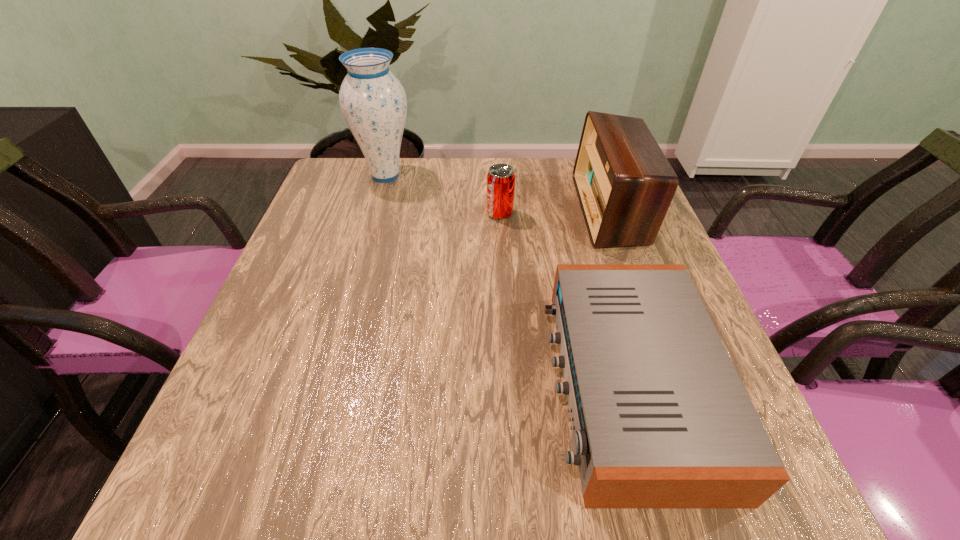
Find the location of a particular element. The image size is (960, 540). the leftmost object is located at coordinates (373, 102).

Find the location of `vase`. vase is located at coordinates (373, 102).

You are a GUI agent. You are given a task and a screenshot of the screen. Output one action in this format:
    pyautogui.click(x=<x>, y=<y>)
    Task: Click on the third shortest object
    Image resolution: width=960 pixels, height=540 pixels.
    Given the screenshot: What is the action you would take?
    pyautogui.click(x=625, y=184)

Identify the location of the taller radio receiver. (625, 184).

I want to click on soda can, so click(500, 179).

In order to click on the third object from right to left in this screenshot , I will do `click(500, 179)`.

You are a GUI agent. You are given a task and a screenshot of the screen. Output one action in this format:
    pyautogui.click(x=<x>, y=<y>)
    Task: Click on the nearest object
    
    Given the screenshot: What is the action you would take?
    pyautogui.click(x=660, y=418)

You are a GUI agent. You are given a task and a screenshot of the screen. Output one action in this format:
    pyautogui.click(x=<x>, y=<y>)
    Task: Click on the nearer radio receiver
    
    Given the screenshot: What is the action you would take?
    pyautogui.click(x=660, y=418)

You are a GUI agent. You are given a task and a screenshot of the screen. Output one action in this format:
    pyautogui.click(x=<x>, y=<y>)
    Task: Click on the free location located 0.320m on the front of the vase
    This screenshot has width=960, height=540.
    Given the screenshot: What is the action you would take?
    tap(358, 272)

This screenshot has height=540, width=960. In order to click on free space located on the front-facing side of the taller radio receiver in this screenshot , I will do click(554, 210).